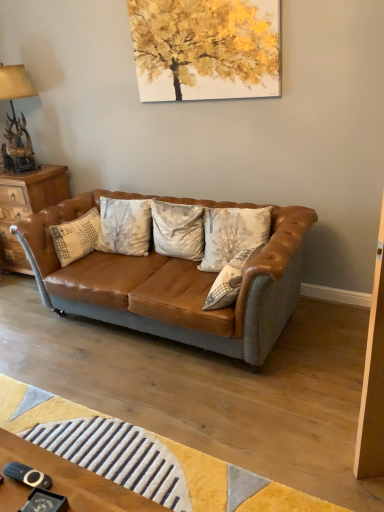
You are a GUI agent. You are given a task and a screenshot of the screen. Output one action in this format:
    pyautogui.click(x=<x>, y=<y>)
    Task: Click on the vacant space in front of wooden nightstand at left
    The image size is (384, 512).
    Given the screenshot: What is the action you would take?
    pyautogui.click(x=17, y=297)